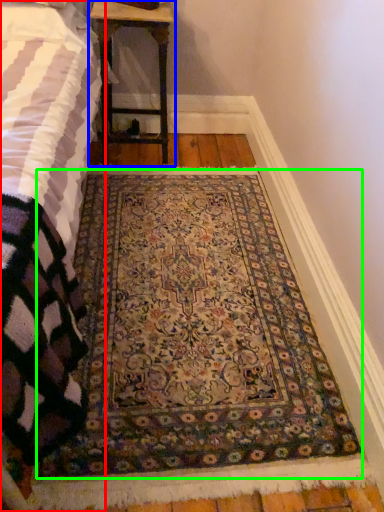
Question: Which is farther away from bed (highlighted by a red box)? table (highlighted by a blue box) or mat (highlighted by a green box)?

Choices:
 (A) table
 (B) mat

Answer: (A)